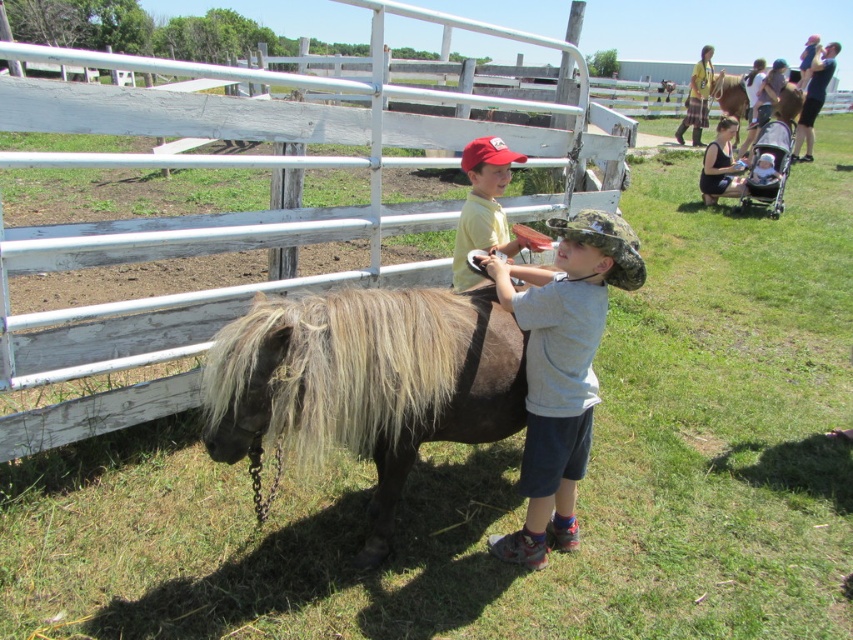
Is white wooden fence at center to the right of matte yellow shirt at upper center from the viewer's perspective?

No, white wooden fence at center is not to the right of matte yellow shirt at upper center.

Does point (62, 129) lie behind point (486, 236)?

That is False.

What are the coordinates of `white wooden fence at center` in the screenshot? It's located at (250, 211).

Can you confirm if camouflage fabric hat at center is shorter than matte yellow shirt at upper center?

In fact, camouflage fabric hat at center may be taller than matte yellow shirt at upper center.

Does camouflage fabric hat at center appear under matte yellow shirt at upper center?

Correct, camouflage fabric hat at center is located below matte yellow shirt at upper center.

Does point (556, 358) lie behind point (461, 168)?

No, (556, 358) is closer to viewer.

Locate an element on the screen. This screenshot has width=853, height=640. camouflage fabric hat at center is located at coordinates (561, 369).

Who is taller, brown fuzzy pony at center or camouflage fabric hat at center?

camouflage fabric hat at center is taller.

Can you confirm if brown fuzzy pony at center is thinner than camouflage fabric hat at center?

No.

Is point (271, 324) farther from camera compared to point (579, 340)?

No, (271, 324) is in front of (579, 340).

Where is `brown fuzzy pony at center`? brown fuzzy pony at center is located at coordinates (364, 381).